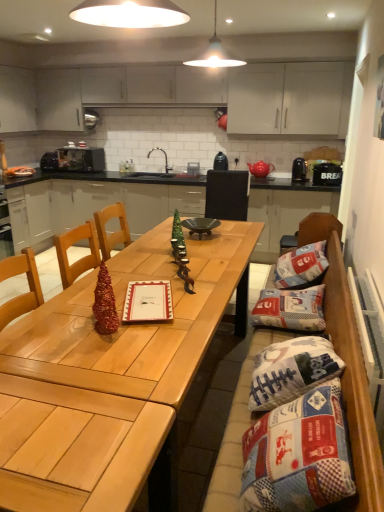
The height and width of the screenshot is (512, 384). Find the location of `vacant point above shiny wood table at center (from a real-world perspective)`. vacant point above shiny wood table at center (from a real-world perspective) is located at coordinates (148, 277).